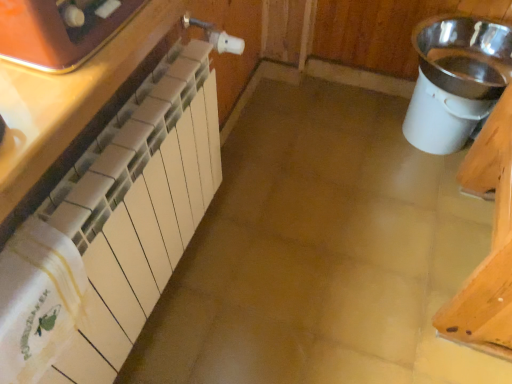
Question: Considering the relative sizes of matte white radiator at left, the 1th cabinetry from the back, and matte orange toaster at upper left in the image provided, is matte white radiator at left, the 1th cabinetry from the back, smaller than matte orange toaster at upper left?

Choices:
 (A) no
 (B) yes

Answer: (A)

Question: Does matte white radiator at left, the second cabinetry positioned from the front, have a greater height compared to matte orange toaster at upper left?

Choices:
 (A) no
 (B) yes

Answer: (B)

Question: Is matte white radiator at left, the 1th cabinetry from the back, facing away from matte orange toaster at upper left?

Choices:
 (A) no
 (B) yes

Answer: (A)

Question: Is matte white radiator at left, the second cabinetry positioned from the front, wider than matte orange toaster at upper left?

Choices:
 (A) no
 (B) yes

Answer: (B)

Question: Would you say matte white radiator at left, the second cabinetry positioned from the front, is outside matte orange toaster at upper left?

Choices:
 (A) no
 (B) yes

Answer: (B)

Question: From the image's perspective, is matte orange toaster at upper left above or below white glossy radiator at left, the 2th cabinetry in the back-to-front sequence?

Choices:
 (A) above
 (B) below

Answer: (A)

Question: In terms of size, does matte orange toaster at upper left appear bigger or smaller than white glossy radiator at left, which appears as the first cabinetry when viewed from the front?

Choices:
 (A) big
 (B) small

Answer: (B)

Question: From a real-world perspective, is matte orange toaster at upper left physically located above or below white glossy radiator at left, which appears as the first cabinetry when viewed from the front?

Choices:
 (A) above
 (B) below

Answer: (A)

Question: Considering the positions of point (101, 6) and point (124, 39), is point (101, 6) closer or farther from the camera than point (124, 39)?

Choices:
 (A) farther
 (B) closer

Answer: (B)

Question: In terms of width, does matte orange toaster at upper left look wider or thinner when compared to silver metallic sink at right?

Choices:
 (A) thin
 (B) wide

Answer: (A)

Question: Is matte orange toaster at upper left taller or shorter than silver metallic sink at right?

Choices:
 (A) short
 (B) tall

Answer: (A)

Question: Is matte orange toaster at upper left in front of or behind silver metallic sink at right in the image?

Choices:
 (A) front
 (B) behind

Answer: (A)

Question: From the image's perspective, is matte orange toaster at upper left above or below silver metallic sink at right?

Choices:
 (A) below
 (B) above

Answer: (A)

Question: From the image's perspective, is matte white radiator at left, the second cabinetry positioned from the front, positioned above or below matte orange toaster at upper left?

Choices:
 (A) above
 (B) below

Answer: (B)

Question: Visually, is matte white radiator at left, the second cabinetry positioned from the front, positioned to the left or to the right of matte orange toaster at upper left?

Choices:
 (A) right
 (B) left

Answer: (A)